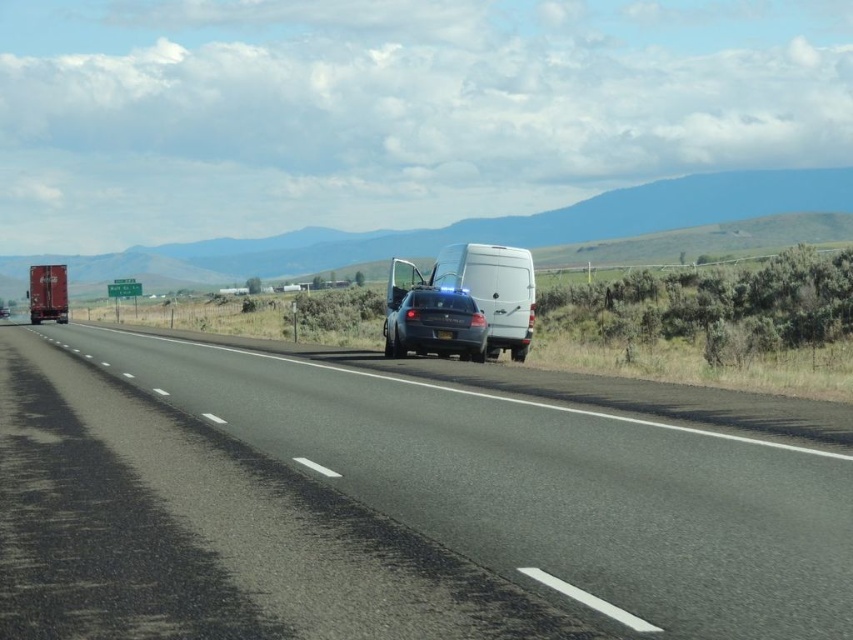
Is white matte van at center wider than metallic red trailer truck at left?

In fact, white matte van at center might be narrower than metallic red trailer truck at left.

Between white matte van at center and metallic red trailer truck at left, which one is positioned higher?

metallic red trailer truck at left is above.

Who is more distant from viewer, (520, 298) or (42, 264)?

Positioned behind is point (42, 264).

Locate an element on the screen. white matte van at center is located at coordinates (492, 291).

The height and width of the screenshot is (640, 853). Identify the location of black asphalt road at center. (387, 506).

Identify the location of black asphalt road at center. (387, 506).

What do you see at coordinates (434, 323) in the screenshot?
I see `satin black sedan at center` at bounding box center [434, 323].

Can you confirm if satin black sedan at center is shorter than metallic red trailer truck at left?

Yes.

Is point (445, 289) more distant than point (54, 301)?

No, (445, 289) is in front of (54, 301).

The image size is (853, 640). Identify the location of satin black sedan at center. (434, 323).